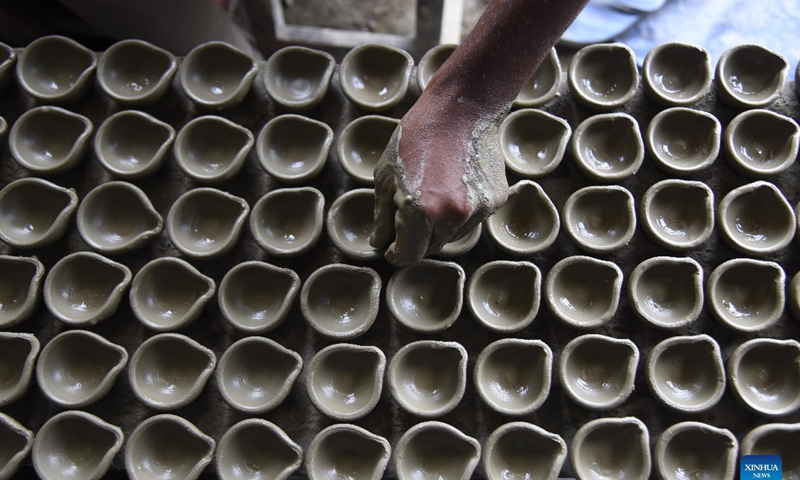
This screenshot has height=480, width=800. Find the location of `cup`. cup is located at coordinates (544, 471).